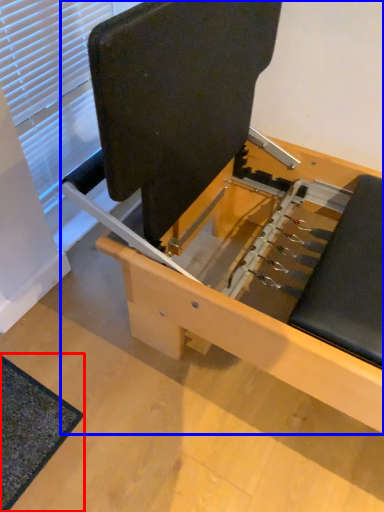
Question: Among these objects, which one is farthest to the camera, mat (highlighted by a red box) or furniture (highlighted by a blue box)?

Choices:
 (A) mat
 (B) furniture

Answer: (A)